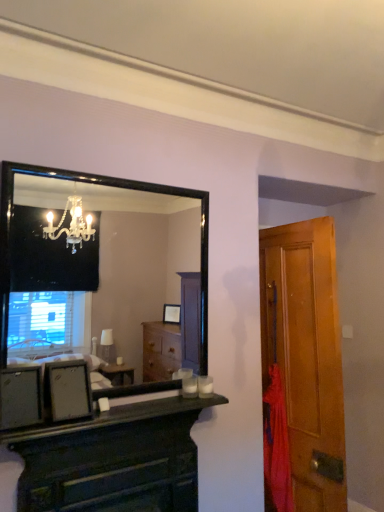
Question: Can you confirm if dark wood chest of drawers at center is smaller than red fabric at right?

Choices:
 (A) no
 (B) yes

Answer: (A)

Question: From a real-world perspective, is dark wood chest of drawers at center on red fabric at right?

Choices:
 (A) no
 (B) yes

Answer: (A)

Question: Does dark wood chest of drawers at center lie in front of red fabric at right?

Choices:
 (A) yes
 (B) no

Answer: (A)

Question: Is dark wood chest of drawers at center facing away from red fabric at right?

Choices:
 (A) no
 (B) yes

Answer: (A)

Question: From a real-world perspective, is dark wood chest of drawers at center below red fabric at right?

Choices:
 (A) no
 (B) yes

Answer: (B)

Question: From a real-world perspective, is matte black picture frame at lower left physically located above or below red fabric at right?

Choices:
 (A) below
 (B) above

Answer: (B)

Question: Considering the positions of matte black picture frame at lower left and red fabric at right in the image, is matte black picture frame at lower left wider or thinner than red fabric at right?

Choices:
 (A) thin
 (B) wide

Answer: (A)

Question: Is matte black picture frame at lower left in front of or behind red fabric at right in the image?

Choices:
 (A) behind
 (B) front

Answer: (B)

Question: Does point (56, 402) appear closer or farther from the camera than point (286, 471)?

Choices:
 (A) farther
 (B) closer

Answer: (B)

Question: Would you say dark wood chest of drawers at center is to the left or to the right of wooden door at right in the picture?

Choices:
 (A) right
 (B) left

Answer: (B)

Question: Choose the correct answer: Is dark wood chest of drawers at center inside wooden door at right or outside it?

Choices:
 (A) inside
 (B) outside

Answer: (B)

Question: Based on their sizes in the image, would you say dark wood chest of drawers at center is bigger or smaller than wooden door at right?

Choices:
 (A) small
 (B) big

Answer: (A)

Question: From a real-world perspective, is dark wood chest of drawers at center physically located above or below wooden door at right?

Choices:
 (A) below
 (B) above

Answer: (A)

Question: Is wooden door at right wider or thinner than matte black picture frame at lower left?

Choices:
 (A) thin
 (B) wide

Answer: (B)

Question: From the image's perspective, relative to matte black picture frame at lower left, is wooden door at right above or below?

Choices:
 (A) above
 (B) below

Answer: (B)